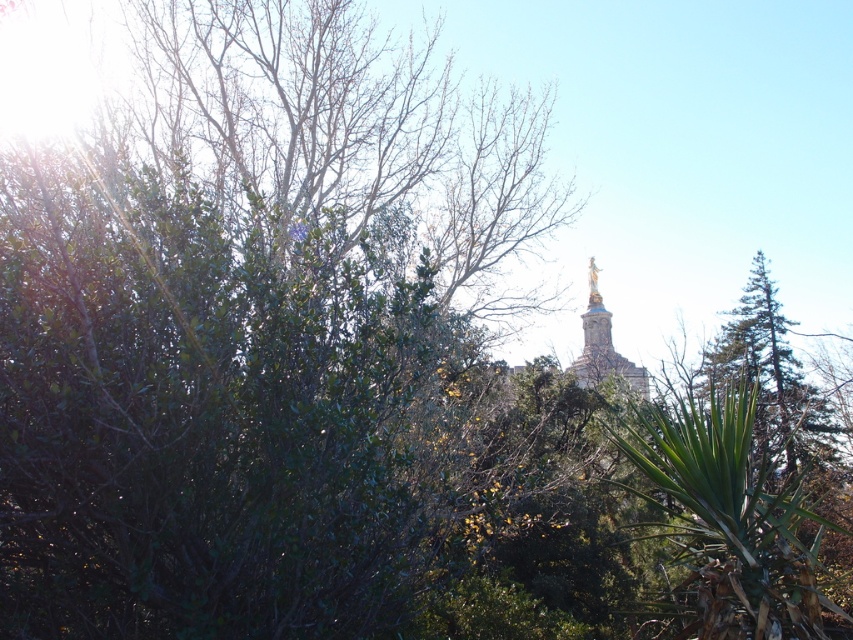
Does point (751, 298) come behind point (598, 300)?

No, it is not.

Is green leafy tree at right positioned in front of gold statue at center?

Yes, it is.

Measure the distance between green leafy tree at right and camera.

green leafy tree at right and camera are 90.41 meters apart.

This screenshot has width=853, height=640. I want to click on green leafy tree at right, so click(770, 378).